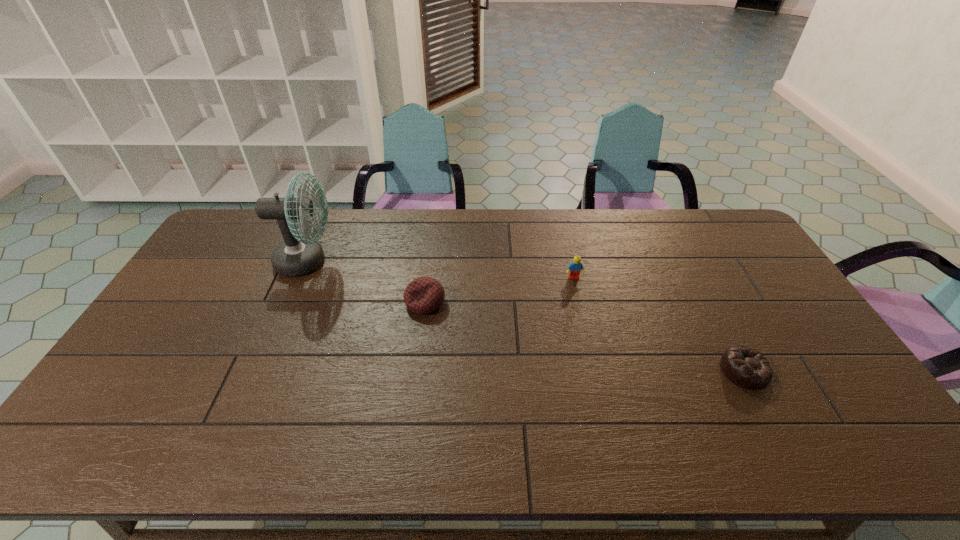
The width and height of the screenshot is (960, 540). I want to click on vacant region at the near right corner, so click(x=861, y=442).

Where is `empty space that is in between the right beanbag and the third farthest object`? Image resolution: width=960 pixels, height=540 pixels. empty space that is in between the right beanbag and the third farthest object is located at coordinates (585, 336).

The width and height of the screenshot is (960, 540). I want to click on free point between the leftmost object and the nearest object, so click(x=525, y=316).

Where is `free area in between the second object from right to left and the farther beanbag`? The height and width of the screenshot is (540, 960). free area in between the second object from right to left and the farther beanbag is located at coordinates (499, 290).

You are a GUI agent. You are given a task and a screenshot of the screen. Output one action in this format:
    pyautogui.click(x=<x>, y=<y>)
    Task: Click on the vacant point located between the leftmost object and the second object from right to left
    This screenshot has height=540, width=960.
    Given the screenshot: What is the action you would take?
    pyautogui.click(x=441, y=269)

At what (x,y) coordinates should I click in order to perform the action: click on free space between the leftmost object and the nearer beanbag. Please return your answer as a coordinate pair (x, y). The image size is (960, 540). Looking at the image, I should click on (525, 316).

The image size is (960, 540). I want to click on free spot between the right beanbag and the fan, so click(x=525, y=316).

Image resolution: width=960 pixels, height=540 pixels. Identify the location of vacant area between the shorter beanbag and the taller beanbag. (585, 336).

Where is `vacant space in between the nearer beanbag and the third farthest object`? The width and height of the screenshot is (960, 540). vacant space in between the nearer beanbag and the third farthest object is located at coordinates (585, 336).

What are the coordinates of `free space that is in between the tallest object and the second nearest object` in the screenshot? It's located at (366, 281).